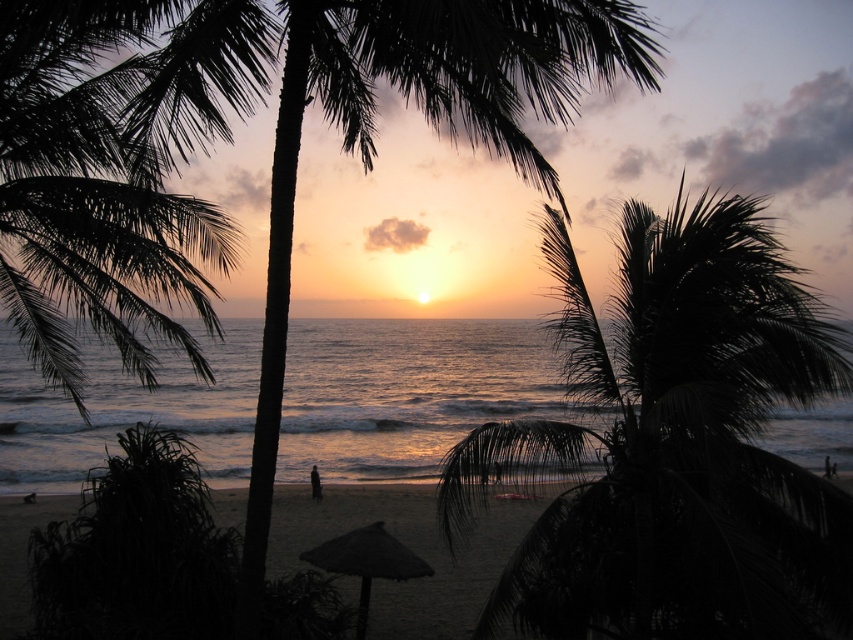
Between dark sand at lower center and brown thatched umbrella at center, which one is positioned lower?

dark sand at lower center

Which is behind, point (271, 563) or point (368, 564)?

Positioned behind is point (271, 563).

Who is more forward, (370,614) or (357,540)?

Point (357,540) is in front.

Identify the location of dark sand at lower center. (x=407, y=545).

Does dark green leafy palm tree at center appear over dark sand at lower center?

Indeed, dark green leafy palm tree at center is positioned over dark sand at lower center.

Can you confirm if dark green leafy palm tree at center is shorter than dark sand at lower center?

No.

Between point (833, 566) and point (457, 598), which one is positioned behind?

The point (457, 598) is more distant.

Where is `dark green leafy palm tree at center`? Image resolution: width=853 pixels, height=640 pixels. dark green leafy palm tree at center is located at coordinates (675, 445).

Is dark green leafy palm tree at center behind golden reflective water at center?

No, dark green leafy palm tree at center is closer to the viewer.

Does point (622, 397) come closer to viewer compared to point (183, 387)?

Yes, point (622, 397) is in front of point (183, 387).

Find the location of a particular element. The height and width of the screenshot is (640, 853). dark green leafy palm tree at center is located at coordinates (675, 445).